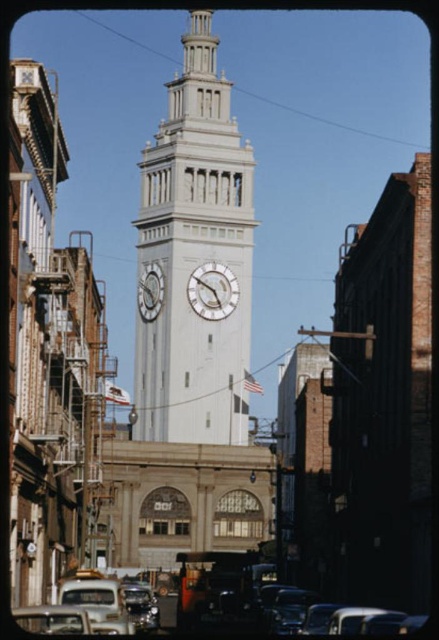
Who is more distant from viewer, (201,289) or (151,284)?

The point (151,284) is more distant.

This screenshot has height=640, width=439. I want to click on white wooden clock at center, so click(x=212, y=291).

Who is taller, metallic silver car at center or white glossy clock at center?

metallic silver car at center

This screenshot has height=640, width=439. In order to click on metallic silver car at center in this screenshot , I will do `click(218, 592)`.

Where is `metallic silver car at center`? metallic silver car at center is located at coordinates (218, 592).

From the picture: Is white stone clock tower at center thinner than white wooden clock at center?

In fact, white stone clock tower at center might be wider than white wooden clock at center.

The image size is (439, 640). What are the coordinates of `white stone clock tower at center` in the screenshot? It's located at (195, 259).

The width and height of the screenshot is (439, 640). In order to click on white stone clock tower at center in this screenshot , I will do `click(195, 259)`.